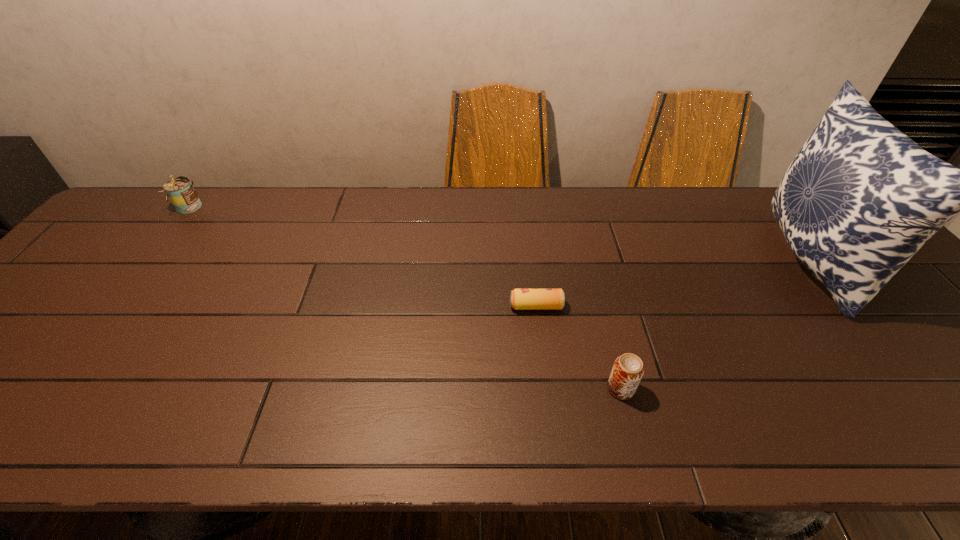
This screenshot has width=960, height=540. Identify the location of the rightmost object. (860, 198).

Where is `cushion`? cushion is located at coordinates (860, 198).

This screenshot has width=960, height=540. In order to click on the second tallest object in this screenshot , I will do `click(180, 190)`.

The image size is (960, 540). Find the location of `the leftmost object`. the leftmost object is located at coordinates pos(180,190).

At what (x,y) coordinates should I click in order to perform the action: click on the taller beer can. Please return your answer as a coordinate pair (x, y). Image resolution: width=960 pixels, height=540 pixels. Looking at the image, I should click on (628, 369).

You are a GUI agent. You are given a task and a screenshot of the screen. Output one action in this format:
    pyautogui.click(x=<x>, y=<y>)
    Task: Click on the nearer beer can
    The width and height of the screenshot is (960, 540).
    Given the screenshot: What is the action you would take?
    pyautogui.click(x=628, y=369)

At what (x,y) coordinates should I click in order to perform the action: click on the shorter beer can. Please return your answer as a coordinate pair (x, y). The image size is (960, 540). Looking at the image, I should click on (520, 299).

Where is `the farther beer can`? the farther beer can is located at coordinates (520, 299).

Image resolution: width=960 pixels, height=540 pixels. I want to click on free spot located on the front surface of the tallest object, so click(x=649, y=261).

Image resolution: width=960 pixels, height=540 pixels. What are the coordinates of `vacant space located 0.310m on the front surface of the tallest object` in the screenshot? It's located at (653, 261).